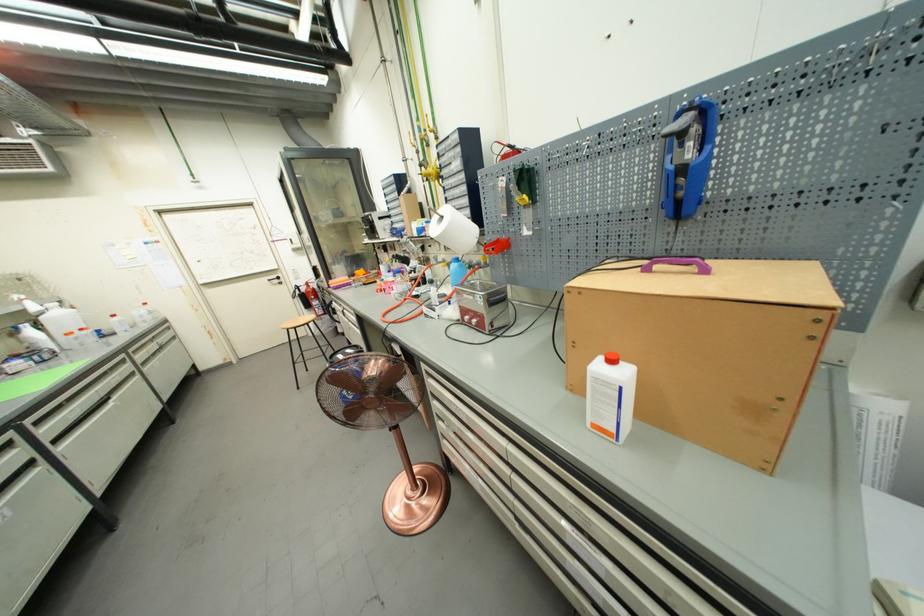
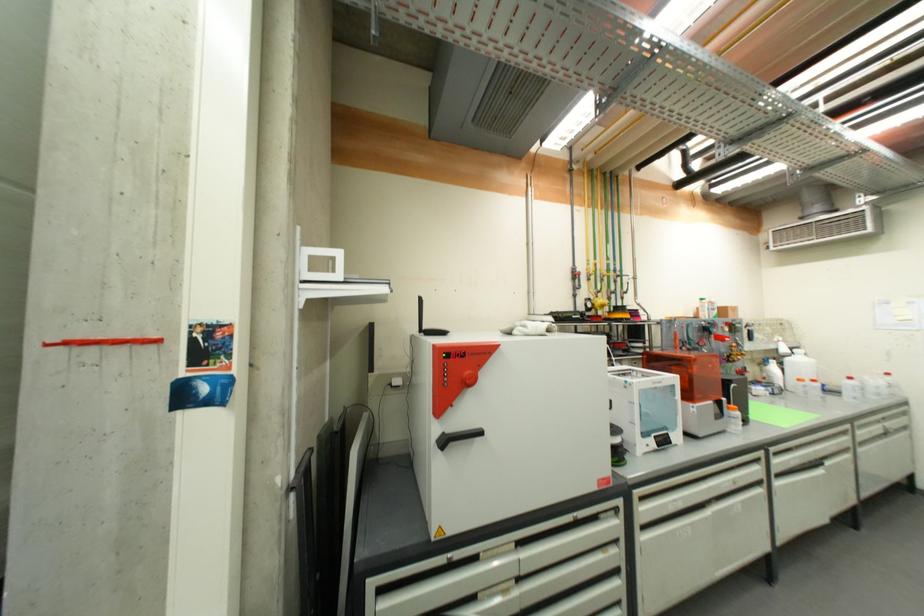
The point at (x=119, y=317) is marked in the first image. Where is the corresponding point in the second image?

(856, 379)